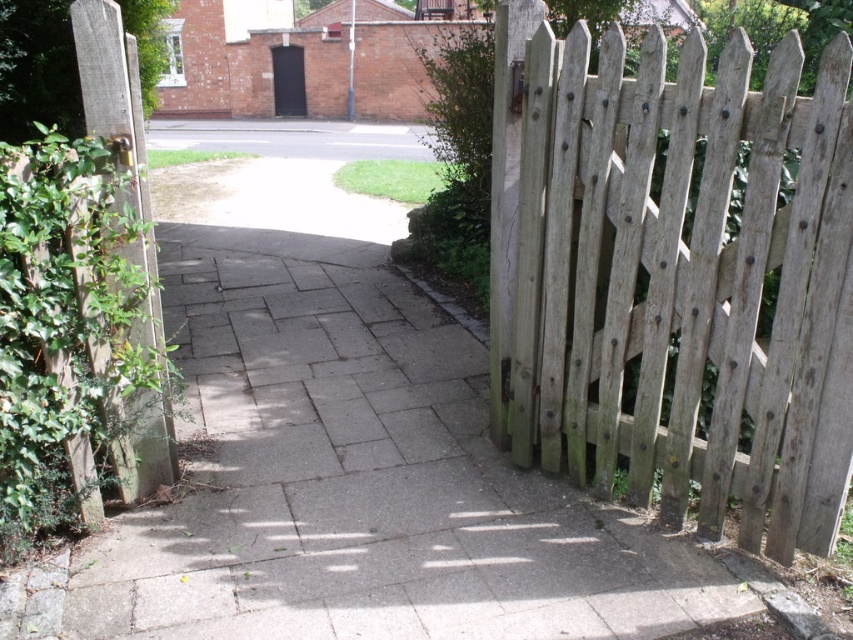
Does gray concrete pavement at center have a lesser width compared to weathered wood fence at right?

Incorrect, gray concrete pavement at center's width is not less than weathered wood fence at right's.

Is point (254, 248) closer to viewer compared to point (624, 320)?

No, (254, 248) is behind (624, 320).

Which is in front, point (136, 561) or point (584, 397)?

Positioned in front is point (136, 561).

The width and height of the screenshot is (853, 640). I want to click on gray concrete pavement at center, so click(x=360, y=477).